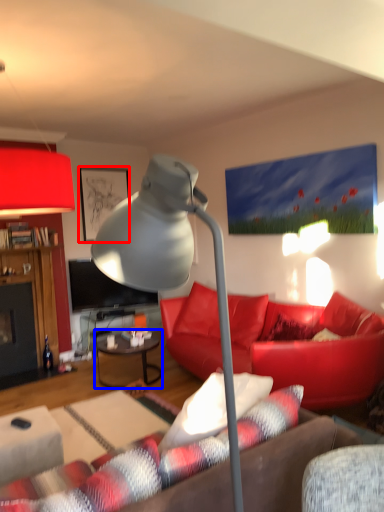
Question: Which of the following is the closest to the observer, picture frame (highlighted by a red box) or table (highlighted by a blue box)?

Choices:
 (A) picture frame
 (B) table

Answer: (B)